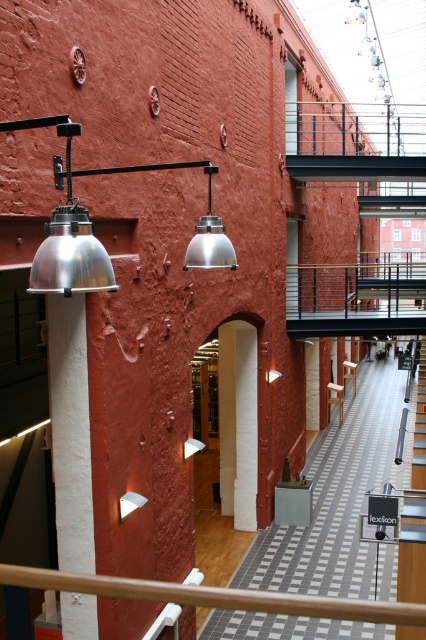
Question: Which point is closer to the camera?

Choices:
 (A) (321, 564)
 (B) (94, 634)
 (C) (339, 413)

Answer: (B)

Question: Which of the following is the closest to the observer?

Choices:
 (A) white painted concrete pillar at left
 (B) light brown wooden stool at center
 (C) polished concrete floor at center
 (D) white matte pillar at center

Answer: (A)

Question: Does white matte pillar at center appear under metallic staircase at center?

Choices:
 (A) yes
 (B) no

Answer: (A)

Question: Based on their relative distances, which object is farther from the light brown wooden stool at center?

Choices:
 (A) white matte pillar at center
 (B) white painted concrete pillar at left
 (C) silver metallic lamp at center

Answer: (B)

Question: Does polished concrete floor at center lie behind metallic staircase at center?

Choices:
 (A) yes
 (B) no

Answer: (A)

Question: Can you confirm if polished concrete floor at center is wider than white matte pillar at center?

Choices:
 (A) yes
 (B) no

Answer: (A)